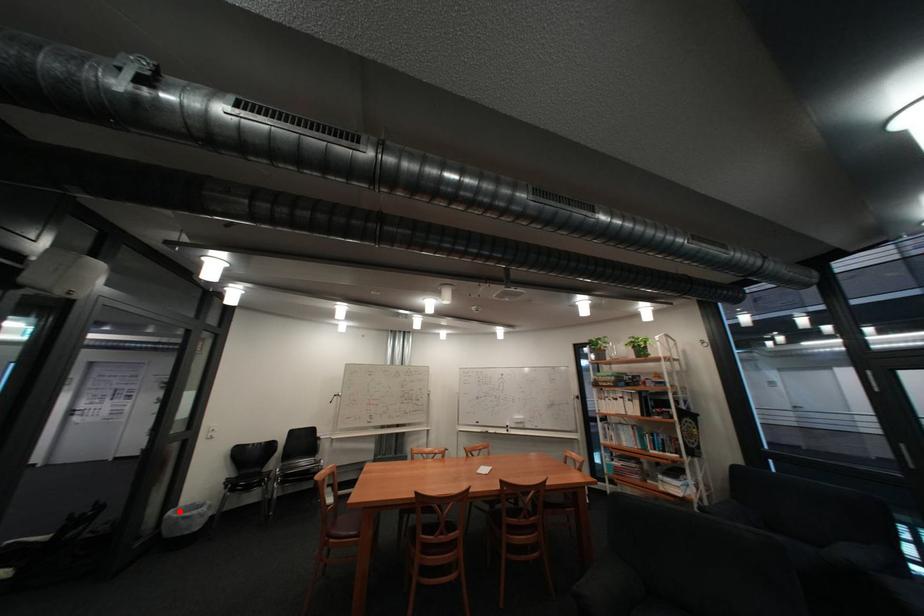
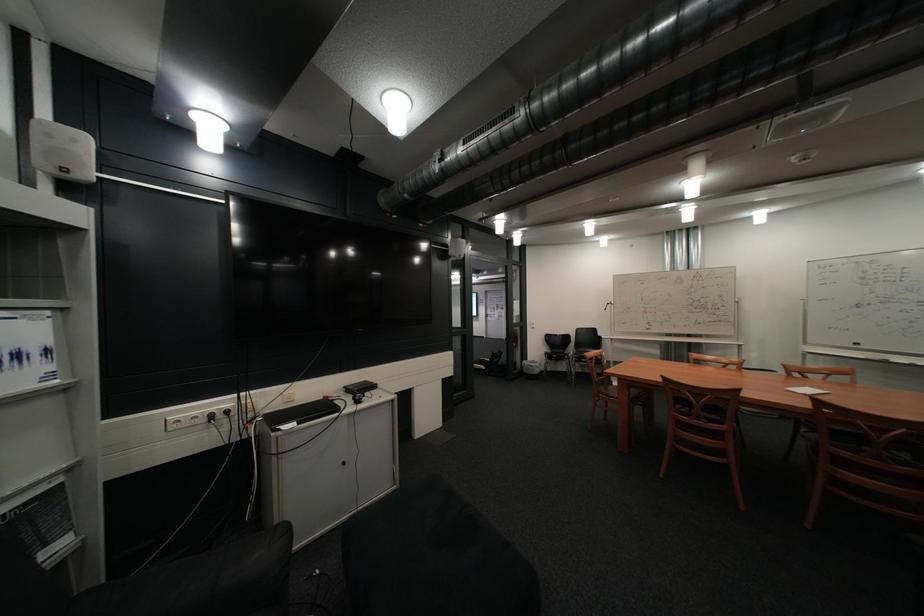
Question: A red point is marked in image1. In image2, is the corresponding 3D point closer to the camera or farther? Reply with the corresponding letter.

Choices:
 (A) The corresponding 3D point is closer.
 (B) The corresponding 3D point is farther.

Answer: (B)